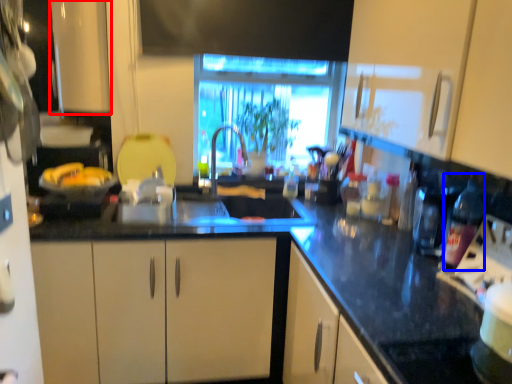
Question: Which object appears farthest to the camera in this image, cabinetry (highlighted by a red box) or bottle (highlighted by a blue box)?

Choices:
 (A) cabinetry
 (B) bottle

Answer: (A)